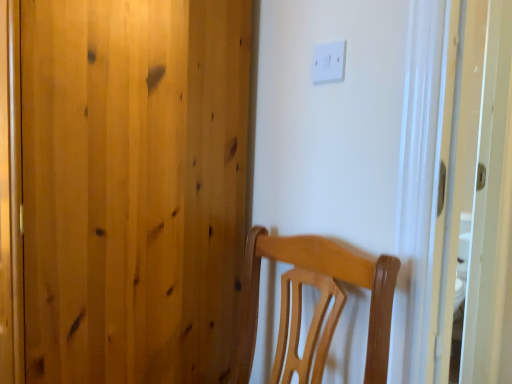
Question: Is natural wood door at center to the left or to the right of white plastic light switch at upper center in the image?

Choices:
 (A) right
 (B) left

Answer: (B)

Question: From the image's perspective, is natural wood door at center positioned above or below white plastic light switch at upper center?

Choices:
 (A) below
 (B) above

Answer: (A)

Question: Looking at the image, does natural wood door at center seem bigger or smaller compared to white plastic light switch at upper center?

Choices:
 (A) big
 (B) small

Answer: (A)

Question: Is white plastic light switch at upper center wider or thinner than natural wood door at center?

Choices:
 (A) wide
 (B) thin

Answer: (B)

Question: From a real-world perspective, relative to natural wood door at center, is white plastic light switch at upper center vertically above or below?

Choices:
 (A) above
 (B) below

Answer: (A)

Question: From the image's perspective, relative to natural wood door at center, is white plastic light switch at upper center above or below?

Choices:
 (A) above
 (B) below

Answer: (A)

Question: Is white plastic light switch at upper center spatially inside natural wood door at center, or outside of it?

Choices:
 (A) inside
 (B) outside

Answer: (B)